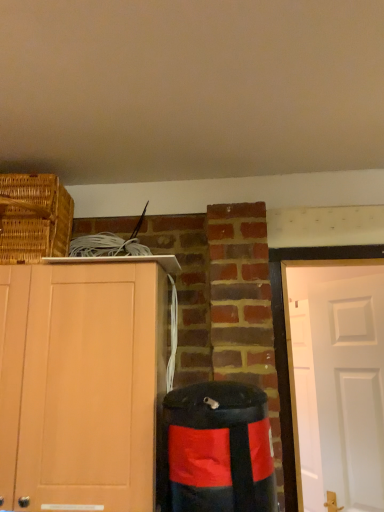
Measure the distance between light wood cabinet at left and camera.

light wood cabinet at left is 1.18 meters away from camera.

The height and width of the screenshot is (512, 384). I want to click on black matte waste container at lower right, so click(x=217, y=450).

Can you confirm if black matte waste container at lower right is smaller than light wood cabinet at left?

Correct, black matte waste container at lower right occupies less space than light wood cabinet at left.

Considering the relative sizes of black matte waste container at lower right and light wood cabinet at left in the image provided, is black matte waste container at lower right thinner than light wood cabinet at left?

Yes.

Between black matte waste container at lower right and light wood cabinet at left, which one is positioned behind?

light wood cabinet at left is further away from the camera.

Would you say light wood cabinet at left is part of black matte waste container at lower right's contents?

Actually, light wood cabinet at left is outside black matte waste container at lower right.

Is light wood cabinet at left at the back of woven brown basket at upper left?

woven brown basket at upper left does not have its back to light wood cabinet at left.

Based on their positions, is woven brown basket at upper left located to the left or right of light wood cabinet at left?

Based on their positions, woven brown basket at upper left is located to the left of light wood cabinet at left.

Does woven brown basket at upper left have a greater width compared to light wood cabinet at left?

Correct, the width of woven brown basket at upper left exceeds that of light wood cabinet at left.

Can you see light wood cabinet at left touching black matte waste container at lower right?

light wood cabinet at left and black matte waste container at lower right are not in contact.

Is light wood cabinet at left not inside black matte waste container at lower right?

Yes, light wood cabinet at left is located beyond the bounds of black matte waste container at lower right.

Considering the relative positions of light wood cabinet at left and black matte waste container at lower right in the image provided, is light wood cabinet at left in front of black matte waste container at lower right?

No, light wood cabinet at left is further to the viewer.

Does light wood cabinet at left turn towards black matte waste container at lower right?

No, light wood cabinet at left is not oriented towards black matte waste container at lower right.

Consider the image. Is light wood cabinet at left turned away from woven brown basket at upper left?

No, light wood cabinet at left is not facing the opposite direction of woven brown basket at upper left.

Is light wood cabinet at left inside or outside of woven brown basket at upper left?

light wood cabinet at left is not inside woven brown basket at upper left, it's outside.

Is light wood cabinet at left touching woven brown basket at upper left?

No, light wood cabinet at left is not next to woven brown basket at upper left.

Can you confirm if light wood cabinet at left is taller than woven brown basket at upper left?

Yes, light wood cabinet at left is taller than woven brown basket at upper left.

Measure the distance between woven brown basket at upper left and black matte waste container at lower right.

woven brown basket at upper left is 29.66 inches from black matte waste container at lower right.

Is black matte waste container at lower right at the back of woven brown basket at upper left?

No, woven brown basket at upper left is not facing away from black matte waste container at lower right.

What are the coordinates of `waste container that is on the right side of woven brown basket at upper left` in the screenshot? It's located at (217, 450).

Which object is further away from the camera taking this photo, woven brown basket at upper left or black matte waste container at lower right?

woven brown basket at upper left is behind.

Based on the photo, which object is further away from the camera taking this photo, black matte waste container at lower right or woven brown basket at upper left?

woven brown basket at upper left is further away from the camera.

Considering the positions of objects black matte waste container at lower right and woven brown basket at upper left in the image provided, who is more to the left, black matte waste container at lower right or woven brown basket at upper left?

Positioned to the left is woven brown basket at upper left.

From the picture: From the image's perspective, which one is positioned higher, black matte waste container at lower right or woven brown basket at upper left?

From the image's view, woven brown basket at upper left is above.

Is black matte waste container at lower right aimed at woven brown basket at upper left?

No, black matte waste container at lower right is not turned towards woven brown basket at upper left.

Find the location of a particular element. The width and height of the screenshot is (384, 512). waste container lying on the right of light wood cabinet at left is located at coordinates (217, 450).

In the image, there is a light wood cabinet at left. Where is `basket above it (from the image's perspective)`? basket above it (from the image's perspective) is located at coordinates (34, 218).

Considering their positions, is woven brown basket at upper left positioned further to black matte waste container at lower right than light wood cabinet at left?

woven brown basket at upper left.

When comparing their distances from woven brown basket at upper left, does light wood cabinet at left or black matte waste container at lower right seem further?

black matte waste container at lower right is further to woven brown basket at upper left.

Which object lies nearer to the anchor point woven brown basket at upper left, black matte waste container at lower right or light wood cabinet at left?

Based on the image, light wood cabinet at left appears to be nearer to woven brown basket at upper left.

Looking at this image, which object lies nearer to the anchor point light wood cabinet at left, woven brown basket at upper left or black matte waste container at lower right?

black matte waste container at lower right.

When comparing their distances from black matte waste container at lower right, does light wood cabinet at left or woven brown basket at upper left seem closer?

light wood cabinet at left is closer to black matte waste container at lower right.

Estimate the real-world distances between objects in this image. Which object is further from light wood cabinet at left, black matte waste container at lower right or woven brown basket at upper left?

Among the two, woven brown basket at upper left is located further to light wood cabinet at left.

At what (x,y) coordinates should I click in order to perform the action: click on cabinetry between woven brown basket at upper left and black matte waste container at lower right in the horizontal direction. Please return your answer as a coordinate pair (x, y). This screenshot has height=512, width=384. Looking at the image, I should click on (80, 385).